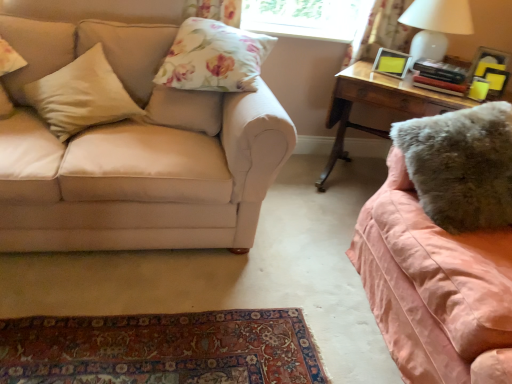
This screenshot has height=384, width=512. I want to click on spots to the right of beige fabric couch at left, the 2th studio couch when ordered from right to left, so click(303, 245).